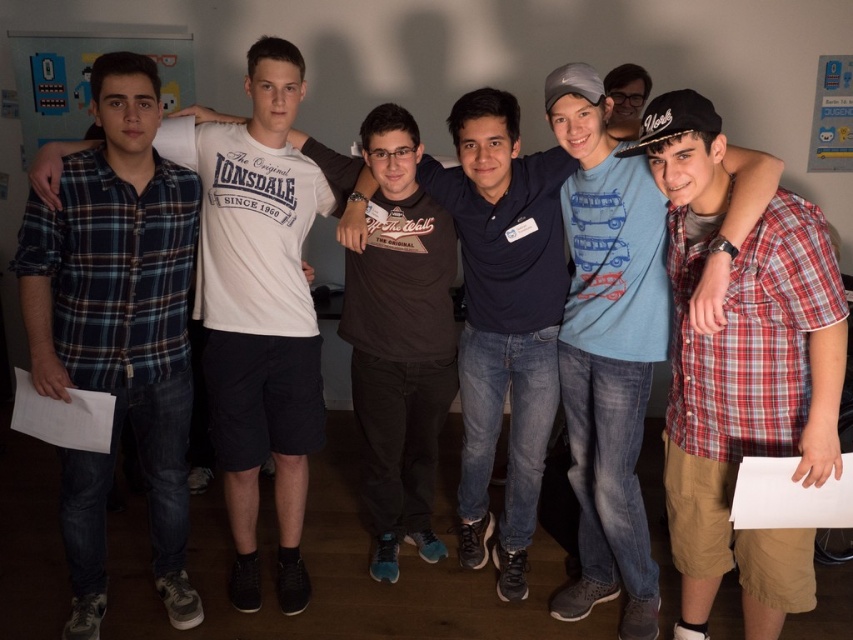
You are standing in the room where the image was taken. You want to find the plaid cotton shirt at right. Which direction should you look to locate it?

The plaid cotton shirt at right is located at the position corresponding to the coordinates point (x=741, y=372) in the image, so you should look to the right side of the image to find it.